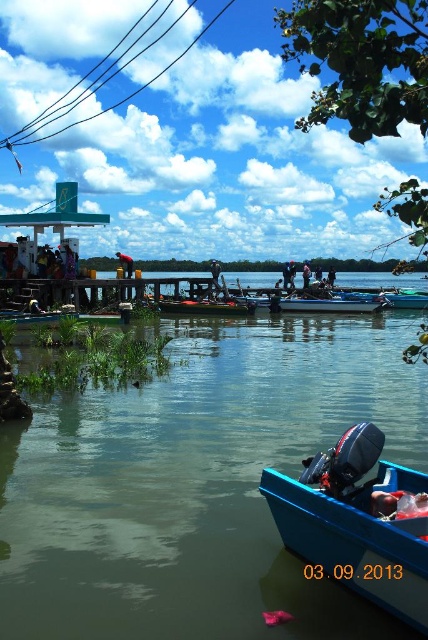
Who is shorter, wooden boat at center or purple fabric at center?

Standing shorter between the two is wooden boat at center.

Is point (199, 298) less distant than point (214, 266)?

Yes, point (199, 298) is in front of point (214, 266).

Between point (247, 304) and point (216, 264), which one is positioned in front?

Point (247, 304) is in front.

The height and width of the screenshot is (640, 428). What are the coordinates of `wooden boat at center` in the screenshot? It's located at pyautogui.click(x=207, y=307).

Looking at this image, does reddish-orange fabric at dock center have a smaller size compared to purple fabric at center?

Indeed, reddish-orange fabric at dock center has a smaller size compared to purple fabric at center.

You are a GUI agent. You are given a task and a screenshot of the screen. Output one action in this format:
    pyautogui.click(x=<x>, y=<y>)
    Task: Click on the reddish-orange fabric at dock center
    
    Given the screenshot: What is the action you would take?
    pyautogui.click(x=125, y=262)

Between point (119, 260) and point (211, 266), which one is positioned behind?

Positioned behind is point (211, 266).

You are a GUI agent. You are given a task and a screenshot of the screen. Output one action in this format:
    pyautogui.click(x=<x>, y=<y>)
    Task: Click on the reddish-orange fabric at dock center
    
    Given the screenshot: What is the action you would take?
    pyautogui.click(x=125, y=262)

What do you see at coordinates (125, 262) in the screenshot? I see `reddish-orange fabric at dock center` at bounding box center [125, 262].

Can you confirm if reddish-orange fabric at dock center is taller than dark blue fabric shirt at center?

Incorrect, reddish-orange fabric at dock center's height is not larger of dark blue fabric shirt at center's.

Which is in front, point (127, 272) or point (327, 280)?

Point (127, 272) is in front.

This screenshot has height=640, width=428. Identify the location of reddish-orange fabric at dock center. (125, 262).